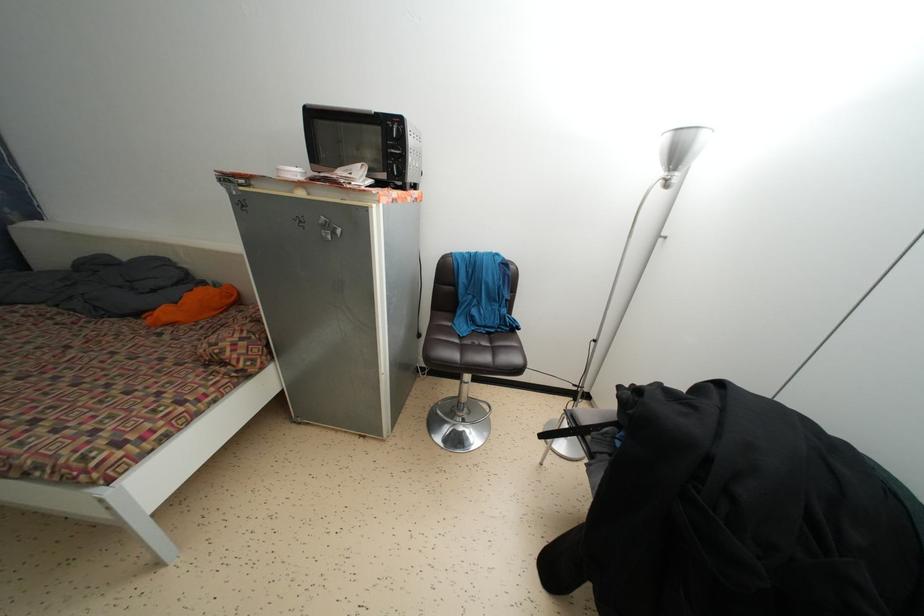
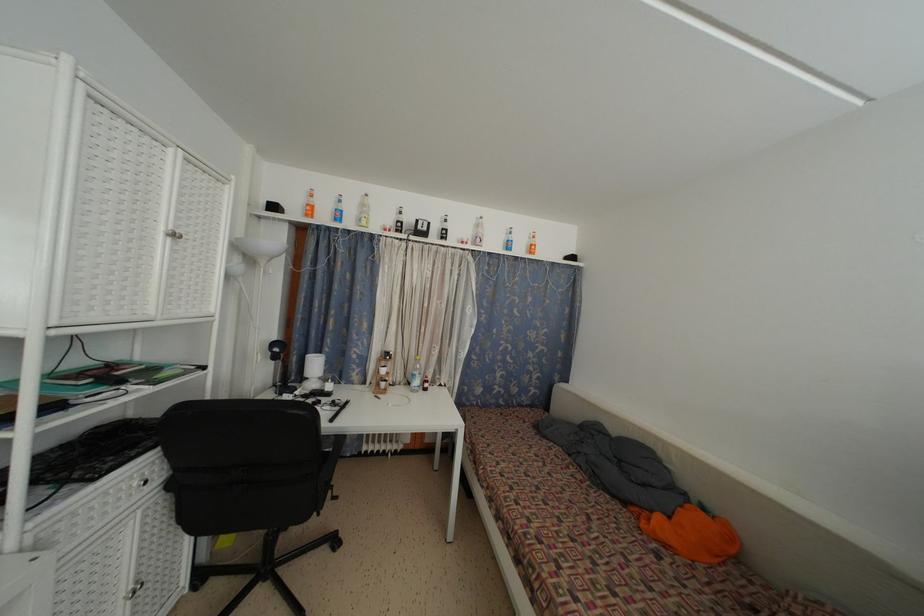
Locate, in the second image, the point that corresponds to point 141,321 in the first image.

(629, 509)